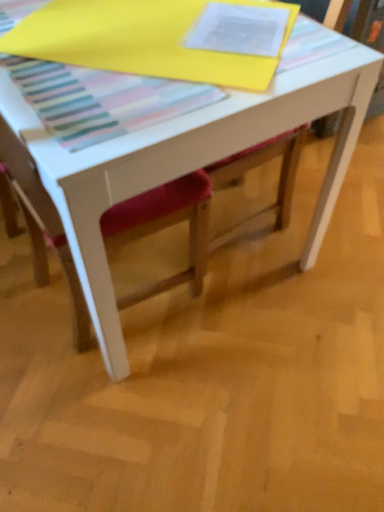
Identify the location of white matte table at center. pos(187,162).

The height and width of the screenshot is (512, 384). What do you see at coordinates (187, 162) in the screenshot? I see `white matte table at center` at bounding box center [187, 162].

Image resolution: width=384 pixels, height=512 pixels. I want to click on velvet red chair at center, so click(x=164, y=226).

Describe the element at coordinates (164, 226) in the screenshot. I see `velvet red chair at center` at that location.

Measure the distance between velvet red chair at center and camera.

The distance of velvet red chair at center from camera is 81.47 centimeters.

Find the location of a particular element. white matte table at center is located at coordinates (187, 162).

Considering the relative positions of velvet red chair at center and white matte table at center in the image provided, is velvet red chair at center to the left of white matte table at center from the viewer's perspective?

Yes.

Relative to white matte table at center, is velvet red chair at center in front or behind?

Clearly, velvet red chair at center is in front of white matte table at center.

Is point (111, 233) closer or farther from the camera than point (148, 141)?

Point (111, 233) is positioned farther from the camera compared to point (148, 141).

From the image's perspective, which one is positioned lower, velvet red chair at center or white matte table at center?

velvet red chair at center.

From a real-world perspective, who is located higher, velvet red chair at center or white matte table at center?

In real-world perspective, velvet red chair at center is above.

Which object is wider, velvet red chair at center or white matte table at center?

With larger width is white matte table at center.

Who is shorter, velvet red chair at center or white matte table at center?

With less height is white matte table at center.

In the scene shown: Considering the relative sizes of velvet red chair at center and white matte table at center in the image provided, is velvet red chair at center bigger than white matte table at center?

Incorrect, velvet red chair at center is not larger than white matte table at center.

Is velvet red chair at center inside the boundaries of white matte table at center, or outside?

velvet red chair at center is spatially positioned inside white matte table at center.

Are velvet red chair at center and white matte table at center beside each other?

No, velvet red chair at center is not next to white matte table at center.

From the picture: Is velvet red chair at center facing away from white matte table at center?

That's right, velvet red chair at center is facing away from white matte table at center.

Can you tell me how much velvet red chair at center and white matte table at center differ in facing direction?

0.00029 degrees.

Where is `table that appears behind the velvet red chair at center`? Image resolution: width=384 pixels, height=512 pixels. table that appears behind the velvet red chair at center is located at coordinates (187, 162).

Which is more to the left, white matte table at center or velvet red chair at center?

From the viewer's perspective, velvet red chair at center appears more on the left side.

Which is behind, white matte table at center or velvet red chair at center?

white matte table at center is more distant.

Does point (51, 167) come farther from viewer compared to point (148, 198)?

No, it is not.

From the image's perspective, would you say white matte table at center is shown under velvet red chair at center?

Incorrect, from the image's perspective, white matte table at center is higher than velvet red chair at center.

From a real-world perspective, who is located higher, white matte table at center or velvet red chair at center?

velvet red chair at center.

Does white matte table at center have a greater width compared to velvet red chair at center?

Indeed, white matte table at center has a greater width compared to velvet red chair at center.

Between white matte table at center and velvet red chair at center, which one has more height?

With more height is velvet red chair at center.

Can you confirm if white matte table at center is bigger than velvet red chair at center?

Correct, white matte table at center is larger in size than velvet red chair at center.

Can velvet red chair at center be found inside white matte table at center?

Yes.

Is there a large distance between white matte table at center and velvet red chair at center?

No, white matte table at center is not far away from velvet red chair at center.

Does white matte table at center turn towards velvet red chair at center?

No, white matte table at center is not facing towards velvet red chair at center.

The image size is (384, 512). I want to click on table that appears above the velvet red chair at center (from the image's perspective), so click(x=187, y=162).

What are the coordinates of `table located above the velvet red chair at center (from the image's perspective)` in the screenshot? It's located at (187, 162).

You are a GUI agent. You are given a task and a screenshot of the screen. Output one action in this format:
    pyautogui.click(x=<x>, y=<y>)
    Task: Click on the chair lying on the left of white matte table at center
    This screenshot has height=512, width=384.
    Given the screenshot: What is the action you would take?
    pyautogui.click(x=164, y=226)